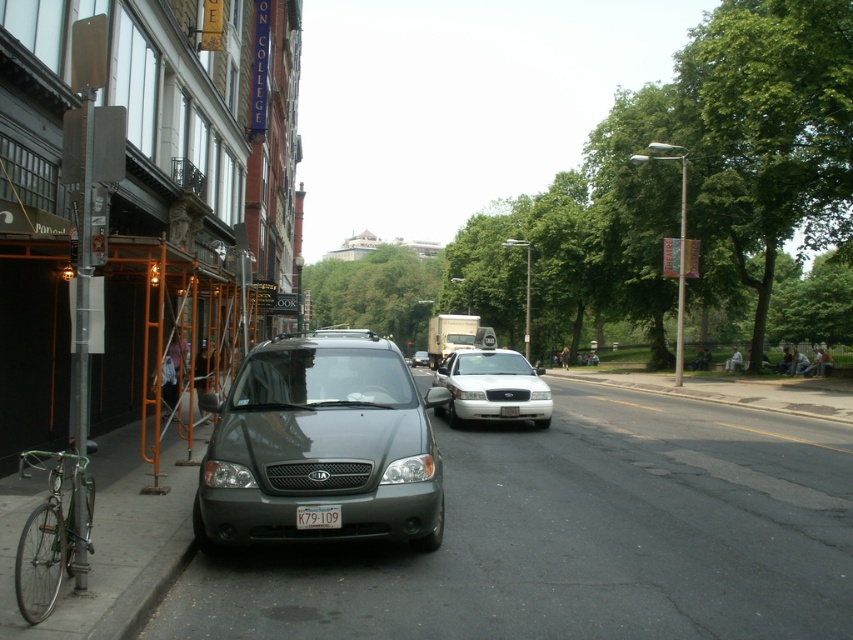
Is green painted curb at lower left to the right of white glossy taxi at center from the viewer's perspective?

Incorrect, green painted curb at lower left is not on the right side of white glossy taxi at center.

Between point (119, 502) and point (469, 369), which one is positioned in front?

Point (119, 502) is in front.

At what (x,y) coordinates should I click in order to perform the action: click on green painted curb at lower left. Please return your answer as a coordinate pair (x, y). Looking at the image, I should click on (111, 547).

Does gray asphalt pavement at lower left have a larger size compared to yellow matte license plate at center?

Indeed, gray asphalt pavement at lower left has a larger size compared to yellow matte license plate at center.

Can you confirm if gray asphalt pavement at lower left is shorter than yellow matte license plate at center?

No, gray asphalt pavement at lower left is not shorter than yellow matte license plate at center.

Does point (691, 540) lie behind point (309, 513)?

Yes.

The image size is (853, 640). In order to click on gray asphalt pavement at lower left in this screenshot , I will do `click(576, 538)`.

Is the position of green painted curb at lower left less distant than that of white plastic license plate at center?

Yes, it is.

Which of these two, green painted curb at lower left or white plastic license plate at center, stands shorter?

With less height is green painted curb at lower left.

Is point (96, 524) behind point (502, 410)?

No, (96, 524) is closer to viewer.

Image resolution: width=853 pixels, height=640 pixels. I want to click on green painted curb at lower left, so click(111, 547).